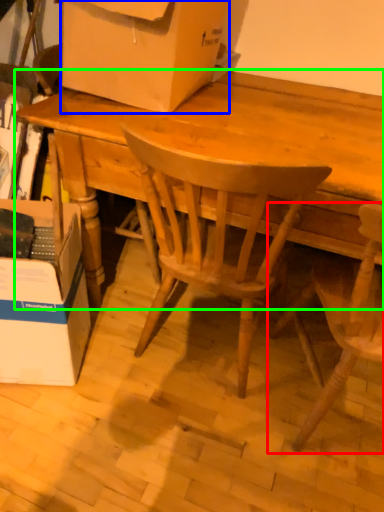
Question: Considering the real-world distances, which object is closest to chair (highlighted by a red box)? box (highlighted by a blue box) or desk (highlighted by a green box).

Choices:
 (A) box
 (B) desk

Answer: (B)